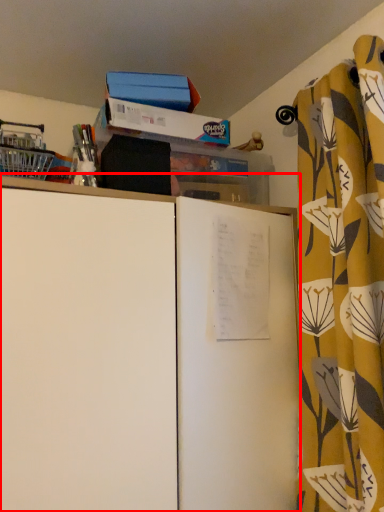
Question: From the image's perspective, what is the correct spatial positioning of cupboard (annotated by the red box) in reference to curtain?

Choices:
 (A) above
 (B) below

Answer: (B)